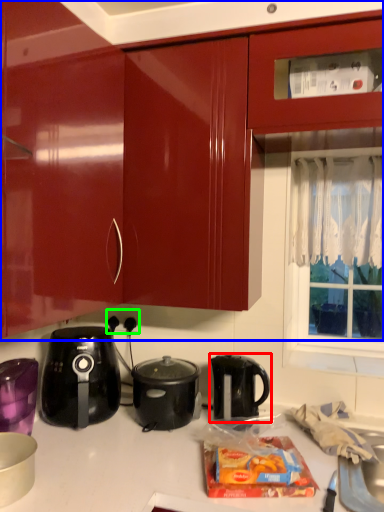
Question: Which object is positioned closest to kettle (highlighted by a red box)? Select from cabinetry (highlighted by a blue box) and electric outlet (highlighted by a green box).

Choices:
 (A) cabinetry
 (B) electric outlet

Answer: (B)